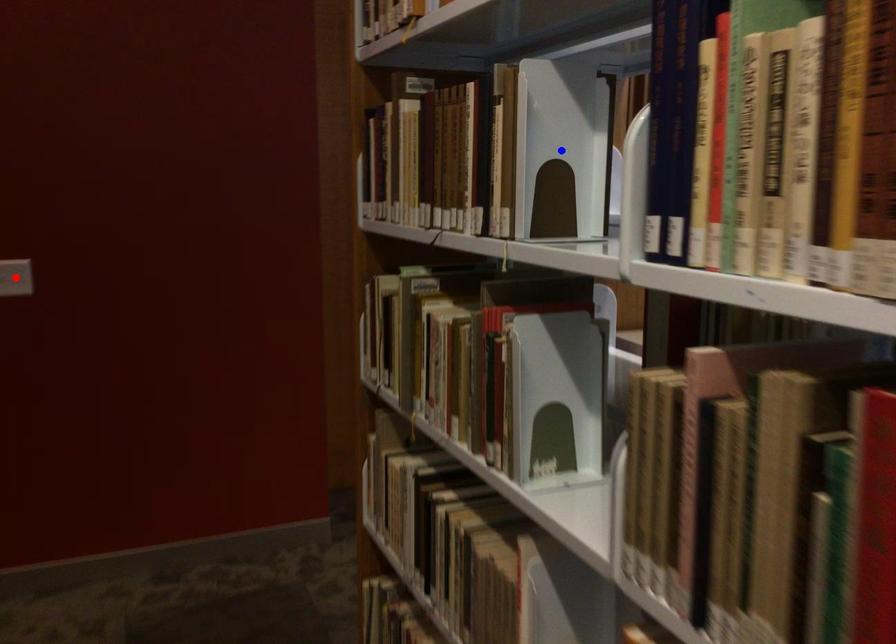
Question: Two points are marked on the image. Which point is closer to the camera?

Choices:
 (A) Blue point is closer.
 (B) Red point is closer.

Answer: (A)